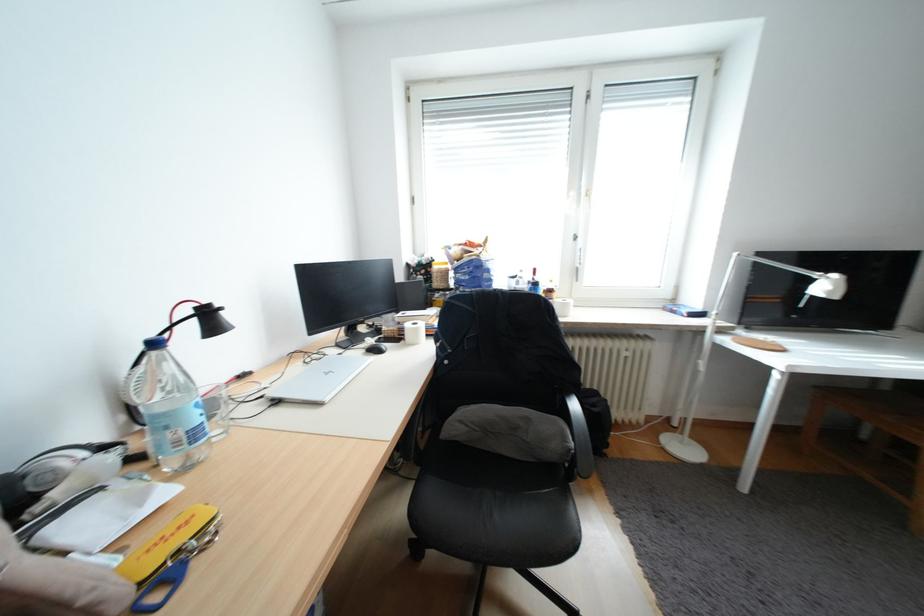
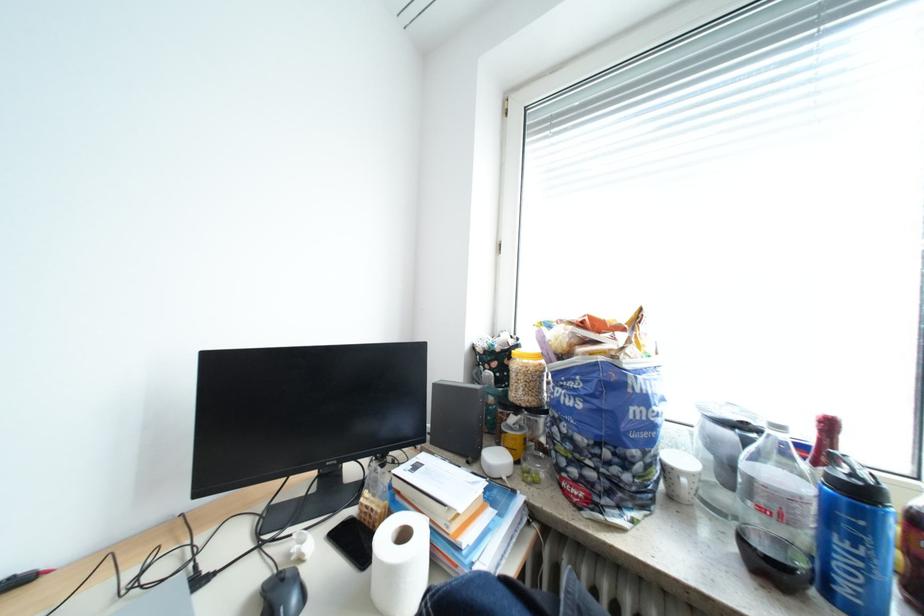
In the second image, find the point that corresponds to the point at 448,285 in the first image.

(529, 394)